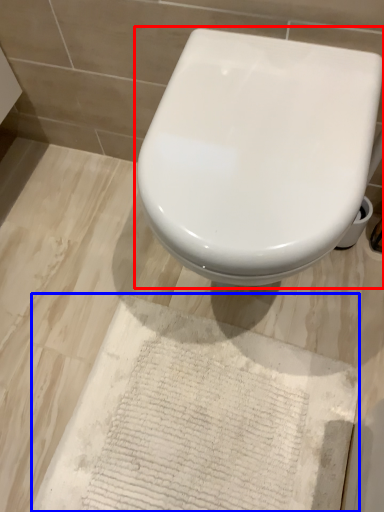
Question: Which of the following is the farthest to the observer, toilet (highlighted by a red box) or parchment (highlighted by a blue box)?

Choices:
 (A) toilet
 (B) parchment

Answer: (B)